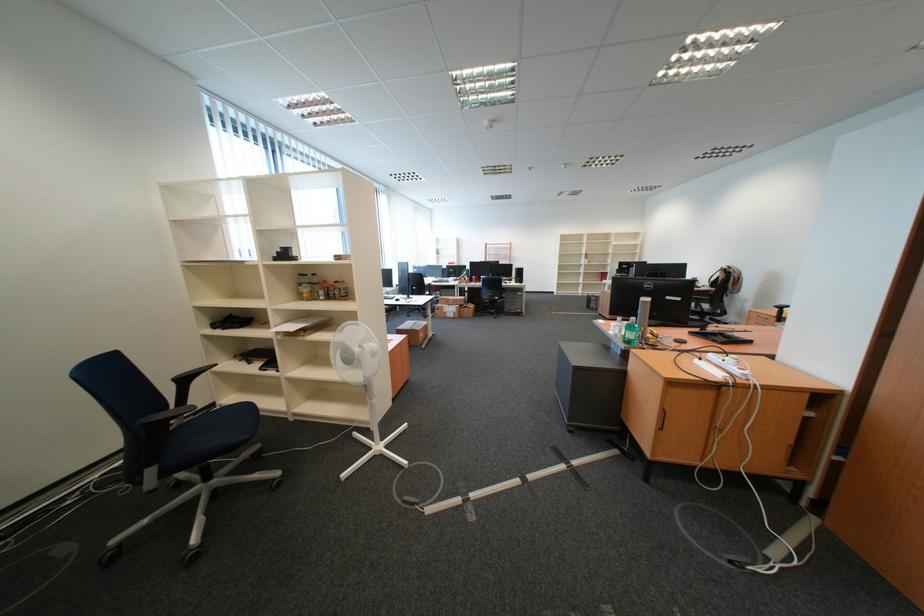
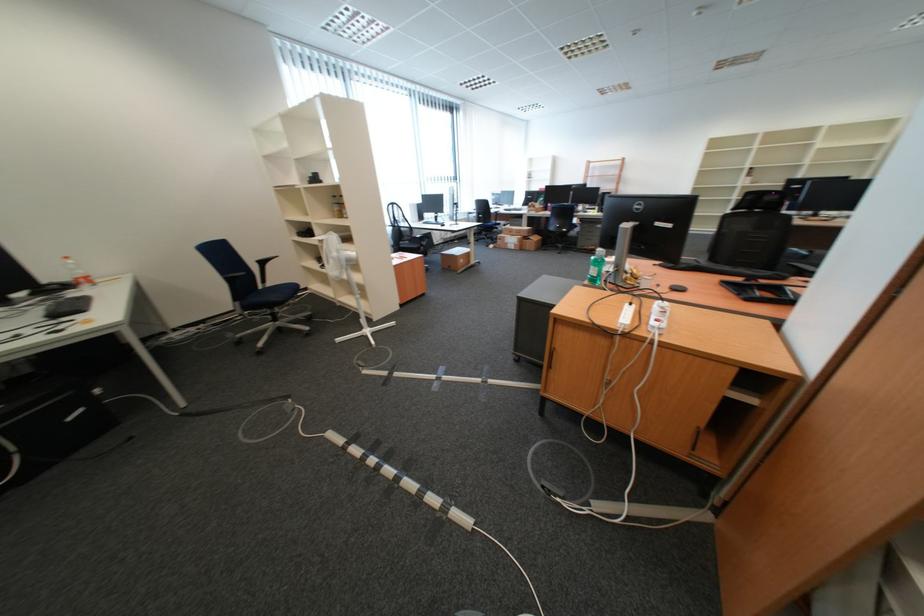
The point at [725,342] is marked in the first image. Where is the corresponding point in the second image?

(749, 296)